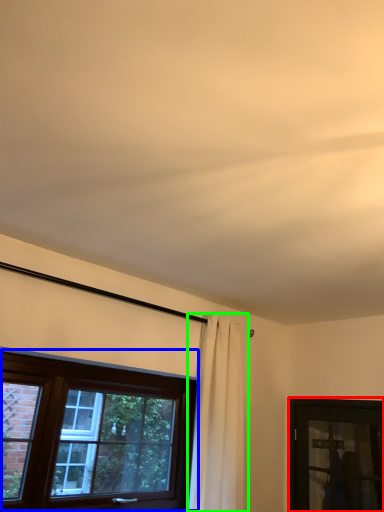
Question: Estimate the real-world distances between objects in this image. Which object is closer to window (highlighted by a red box), window (highlighted by a blue box) or curtain (highlighted by a green box)?

Choices:
 (A) window
 (B) curtain

Answer: (B)